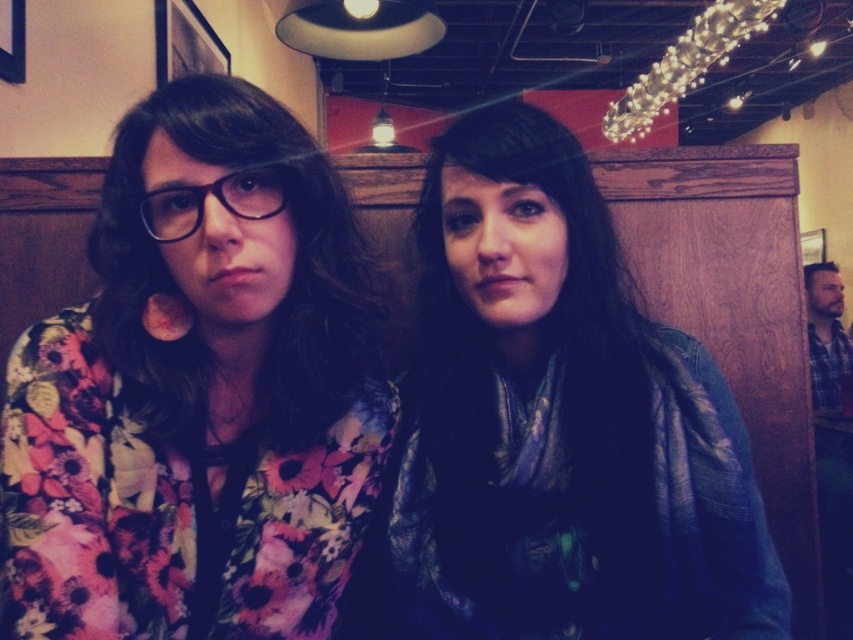
Question: Is floral fabric shirt at left to the right of shiny blue scarf at center from the viewer's perspective?

Choices:
 (A) yes
 (B) no

Answer: (B)

Question: Which object appears farthest from the camera in this image?

Choices:
 (A) shiny blue scarf at center
 (B) floral fabric shirt at left
 (C) matte black glasses at center

Answer: (A)

Question: Which object is the closest to the shiny blue scarf at center?

Choices:
 (A) matte black glasses at center
 (B) floral fabric shirt at left

Answer: (B)

Question: Is floral fabric shirt at left wider than matte black glasses at center?

Choices:
 (A) yes
 (B) no

Answer: (A)

Question: Can you confirm if floral fabric shirt at left is positioned to the right of matte black glasses at center?

Choices:
 (A) yes
 (B) no

Answer: (A)

Question: Which object appears closest to the camera in this image?

Choices:
 (A) shiny blue scarf at center
 (B) matte black glasses at center

Answer: (B)